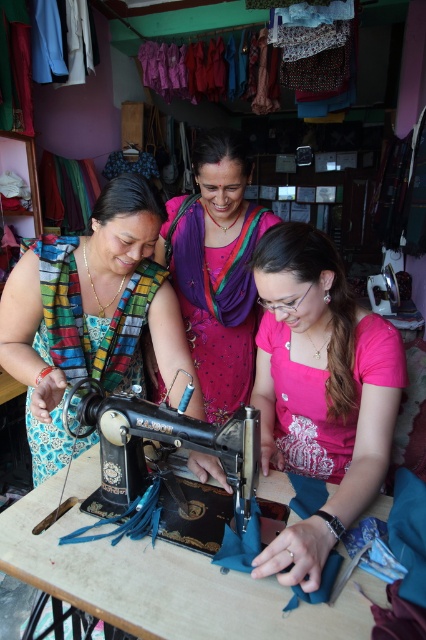
Is pink satin shirt at center further to camera compared to pink satin saree at center?

No, pink satin shirt at center is closer to the viewer.

Between pink satin shirt at center and pink satin saree at center, which one is positioned lower?

pink satin shirt at center is below.

Identify the location of pink satin shirt at center. The width and height of the screenshot is (426, 640). pos(319,390).

Is pink satin saree at center positioned at the back of black metal sewing machine at center?

That is True.

Can you confirm if pink satin saree at center is bigger than black metal sewing machine at center?

Correct, pink satin saree at center is larger in size than black metal sewing machine at center.

You are a GUI agent. You are given a task and a screenshot of the screen. Output one action in this format:
    pyautogui.click(x=<x>, y=<y>)
    Task: Click on the pink satin saree at center
    The width and height of the screenshot is (426, 640).
    Given the screenshot: What is the action you would take?
    pyautogui.click(x=216, y=268)

What do you see at coordinates (319, 390) in the screenshot? This screenshot has width=426, height=640. I see `pink satin shirt at center` at bounding box center [319, 390].

Can you confirm if pink satin shirt at center is bigger than multicolored fabric at center?

No.

Who is more distant from viewer, (330, 518) or (120, 314)?

Point (120, 314)

Identify the location of pink satin shirt at center. The image size is (426, 640). (319, 390).